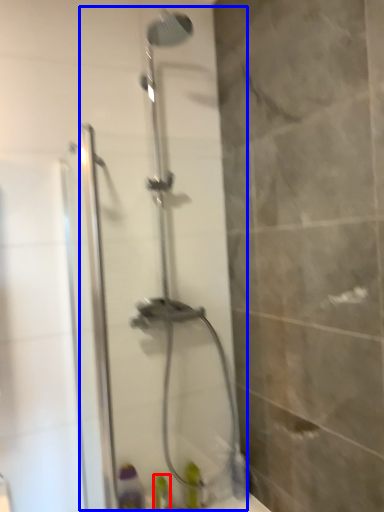
Question: Among these objects, which one is nearest to the camera, toiletry (highlighted by a red box) or shower door (highlighted by a blue box)?

Choices:
 (A) toiletry
 (B) shower door

Answer: (B)